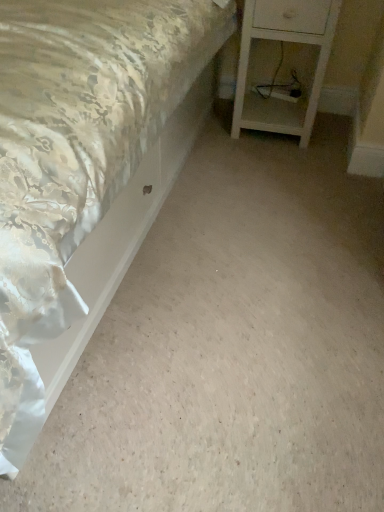
At what (x,y) coordinates should I click in order to perform the action: click on free space above silky satin bed at upper left (from a real-world perspective). Please return your answer as a coordinate pair (x, y). The image size is (384, 512). Looking at the image, I should click on (246, 273).